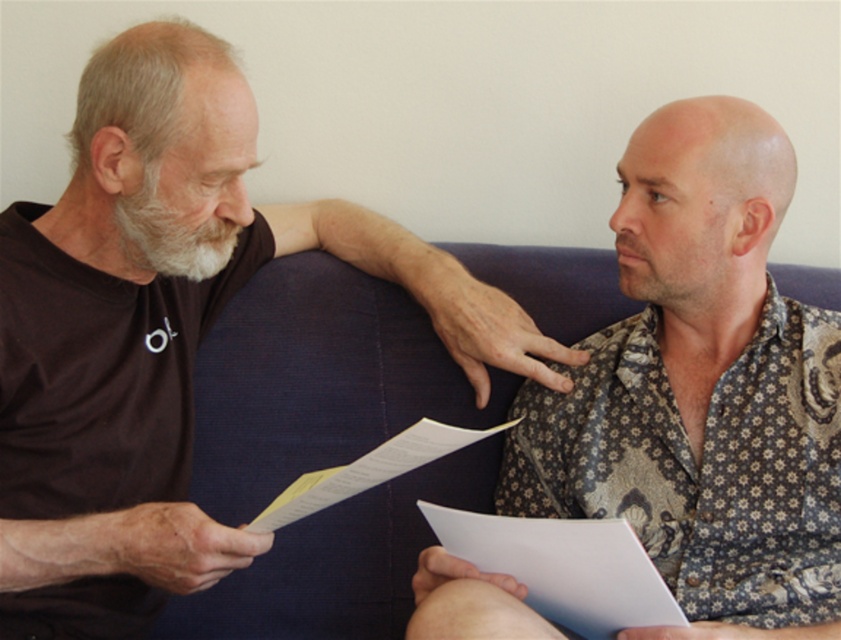
Is point (184, 390) closer to viewer compared to point (748, 621)?

That is False.

Based on the photo, is brown cotton shirt at left below floral-patterned shirt at center?

Incorrect, brown cotton shirt at left is not positioned below floral-patterned shirt at center.

Does point (85, 218) come in front of point (599, 516)?

Yes.

At what (x,y) coordinates should I click in order to perform the action: click on brown cotton shirt at left. Please return your answer as a coordinate pair (x, y). Looking at the image, I should click on (164, 337).

Who is lower down, floral-patterned shirt at center or white paper at center?

white paper at center is lower down.

Which is more to the right, floral-patterned shirt at center or white paper at center?

Positioned to the right is floral-patterned shirt at center.

Does point (712, 230) lie in front of point (475, 429)?

No, (712, 230) is behind (475, 429).

Identify the location of floral-patterned shirt at center. The image size is (841, 640). [702, 388].

Measure the distance between point [289,492] and camera.

Point [289,492] is 3.92 feet from camera.

Can you confirm if white paper at center is positioned below white soft beard at left?

Correct, white paper at center is located below white soft beard at left.

Is point (414, 458) positioned before point (204, 237)?

No.

Image resolution: width=841 pixels, height=640 pixels. What are the coordinates of `white paper at center` in the screenshot? It's located at (368, 470).